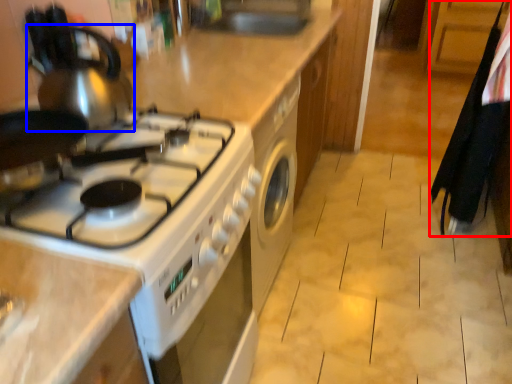
Question: Which of the following is the farthest to the observer, laundry (highlighted by a red box) or tea pot (highlighted by a blue box)?

Choices:
 (A) laundry
 (B) tea pot

Answer: (A)